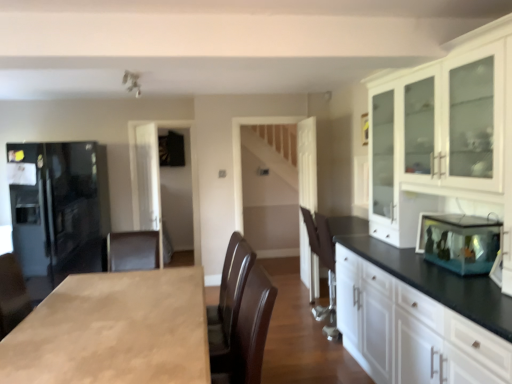
Question: Considering the positions of light brown wood countertop at center and transparent glass fish tank at right in the image, is light brown wood countertop at center bigger or smaller than transparent glass fish tank at right?

Choices:
 (A) small
 (B) big

Answer: (B)

Question: From a real-world perspective, is light brown wood countertop at center above or below transparent glass fish tank at right?

Choices:
 (A) below
 (B) above

Answer: (A)

Question: Which object is positioned farthest from the black glossy refrigerator at left?

Choices:
 (A) transparent glass fish tank at right
 (B) brown leather armchair at center
 (C) light brown wood countertop at center
 (D) transparent glass cabinet at center

Answer: (A)

Question: Which is nearer to the light brown wood countertop at center?

Choices:
 (A) brown leather armchair at center
 (B) transparent glass cabinet at center
 (C) black glossy refrigerator at left
 (D) transparent glass fish tank at right

Answer: (A)